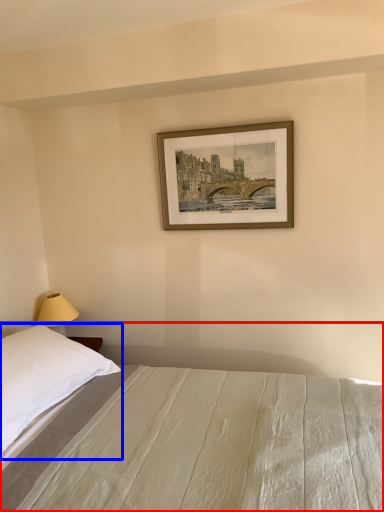
Question: Among these objects, which one is farthest to the camera, bed (highlighted by a red box) or pillow (highlighted by a blue box)?

Choices:
 (A) bed
 (B) pillow

Answer: (B)